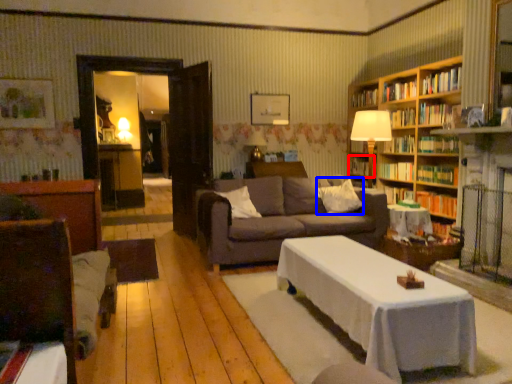
Question: Which object is closer to the camera taking this photo, book (highlighted by a red box) or pillow (highlighted by a blue box)?

Choices:
 (A) book
 (B) pillow

Answer: (B)